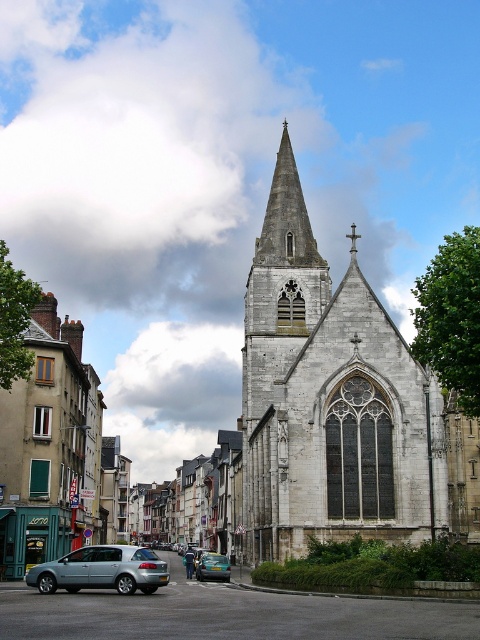
You are a photographer standing on the sidewalk in front of the stone church at center. You want to take a photo of the church without any cars blocking the view. Is the light blue metallic hatchback at lower left currently blocking your view of the church?

The stone church at center is positioned under the light blue metallic hatchback at lower left, so the hatchback is blocking the view of the church. To take a photo without the car blocking the view, you would need to move to a position where the hatchback is no longer in front of the church.

You are a city planner assessing the historic church and a car in the scene. Which object is taller between the gray stone church at center and the metallic blue sedan at center?

The gray stone church at center is taller than the metallic blue sedan at center according to the description.